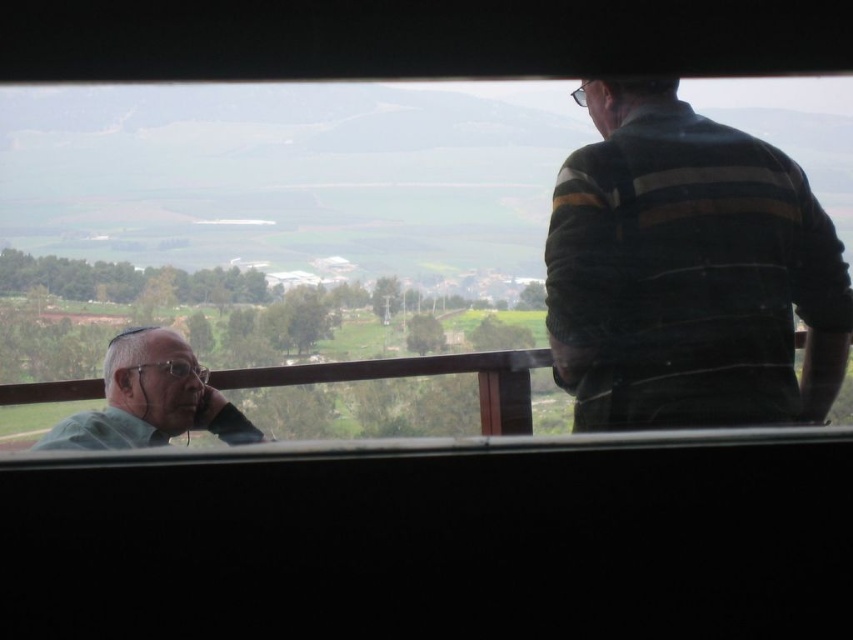
You are standing at the viewing platform and want to know how far the point at coordinates (99, 154) is from your current position. Can you determine the distance?

The point at coordinates (99, 154) is 4.88 feet away from your current position.

You are standing at the viewing platform and want to take a photo of the vast landscape through the transparent glass window at center. Is the window positioned in a way that allows you to capture the entire scene without any obstruction?

The transparent glass window at center is located at point coordinates, so it is positioned in a way that allows you to capture the entire scene without any obstruction.

You are standing behind two people on a viewing platform. The transparent glass window at center is between you and the green matte shirt at left. Can you see the shirt clearly through the window?

The transparent glass window at center is much taller than the green matte shirt at left, so yes, the shirt can be seen clearly through the window because the window is larger in height compared to the shirt.